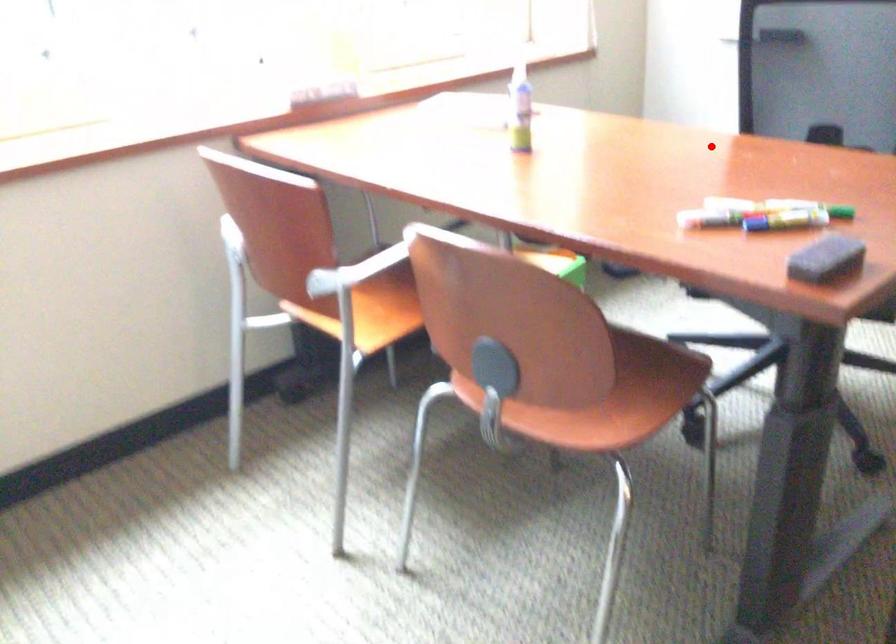
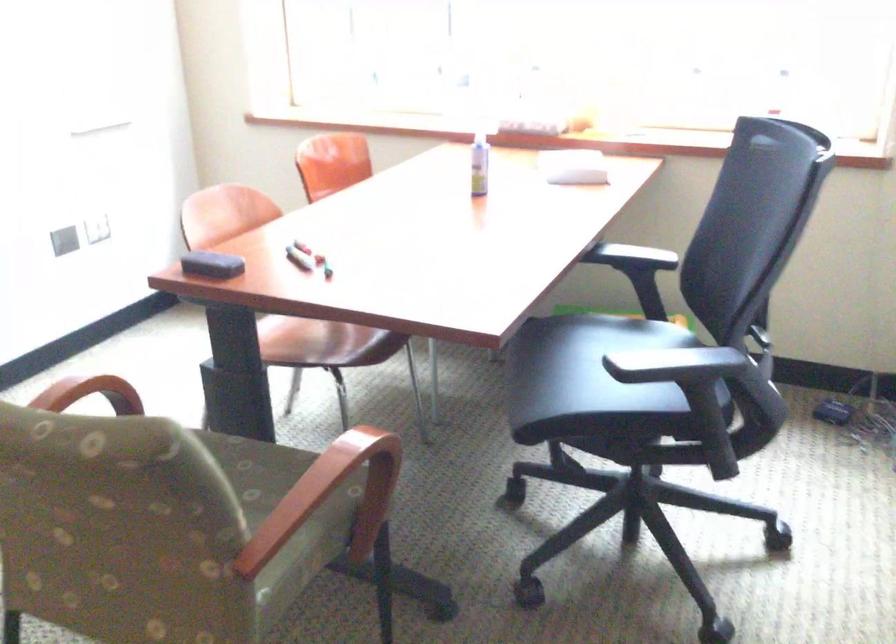
Question: I am providing you with two images of the same scene from different viewpoints. A red point is marked on the first image. Is the red point's position out of view in image 2?

Choices:
 (A) Yes
 (B) No

Answer: (B)